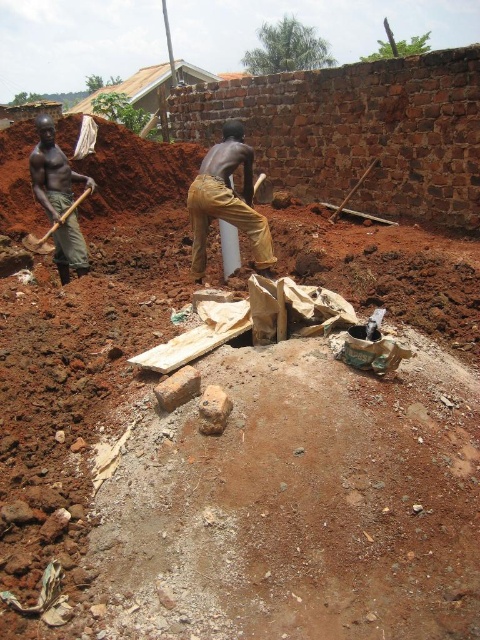
Question: Which of these objects is positioned farthest from the wooden handle shovel at left?

Choices:
 (A) dark skin shovel at left
 (B) brown cotton pants at center

Answer: (B)

Question: In this image, where is dark skin shovel at left located relative to wooden handle shovel at left?

Choices:
 (A) right
 (B) left

Answer: (A)

Question: Which object appears farthest from the camera in this image?

Choices:
 (A) wooden handle shovel at left
 (B) brown cotton pants at center

Answer: (A)

Question: Is brown cotton pants at center closer to the viewer compared to wooden handle shovel at left?

Choices:
 (A) yes
 (B) no

Answer: (A)

Question: Which object appears farthest from the camera in this image?

Choices:
 (A) brown cotton pants at center
 (B) dark skin shovel at left

Answer: (B)

Question: Is brown cotton pants at center further to the viewer compared to wooden handle shovel at left?

Choices:
 (A) yes
 (B) no

Answer: (B)